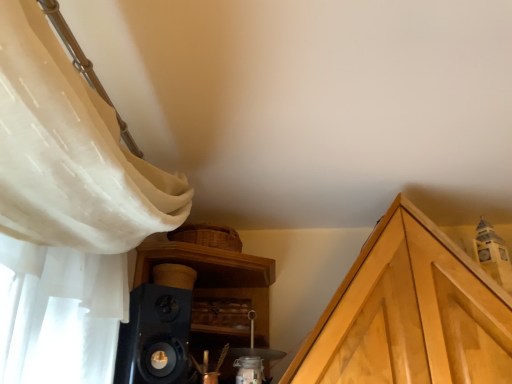
Question: Should I look upward or downward to see light wood cabinetry at upper right?

Choices:
 (A) up
 (B) down

Answer: (B)

Question: Is black matte speaker at lower left positioned with its back to light wood cabinetry at upper right?

Choices:
 (A) no
 (B) yes

Answer: (A)

Question: Can you confirm if black matte speaker at lower left is taller than light wood cabinetry at upper right?

Choices:
 (A) yes
 (B) no

Answer: (B)

Question: Is black matte speaker at lower left outside of light wood cabinetry at upper right?

Choices:
 (A) no
 (B) yes

Answer: (B)

Question: Is the position of black matte speaker at lower left less distant than that of light wood cabinetry at upper right?

Choices:
 (A) no
 (B) yes

Answer: (B)

Question: Considering the relative sizes of black matte speaker at lower left and light wood cabinetry at upper right in the image provided, is black matte speaker at lower left bigger than light wood cabinetry at upper right?

Choices:
 (A) yes
 (B) no

Answer: (B)

Question: From the image's perspective, is black matte speaker at lower left over light wood cabinetry at upper right?

Choices:
 (A) no
 (B) yes

Answer: (B)

Question: Considering the relative positions of light wood cabinetry at upper right and black matte speaker at lower left in the image provided, is light wood cabinetry at upper right to the right of black matte speaker at lower left from the viewer's perspective?

Choices:
 (A) yes
 (B) no

Answer: (A)

Question: Can you confirm if light wood cabinetry at upper right is bigger than black matte speaker at lower left?

Choices:
 (A) no
 (B) yes

Answer: (B)

Question: Does light wood cabinetry at upper right appear on the left side of black matte speaker at lower left?

Choices:
 (A) yes
 (B) no

Answer: (B)

Question: Does light wood cabinetry at upper right have a greater height compared to black matte speaker at lower left?

Choices:
 (A) no
 (B) yes

Answer: (B)

Question: From a real-world perspective, is light wood cabinetry at upper right located beneath black matte speaker at lower left?

Choices:
 (A) no
 (B) yes

Answer: (A)

Question: Can black matte speaker at lower left be found inside light wood cabinetry at upper right?

Choices:
 (A) yes
 (B) no

Answer: (B)

Question: In terms of size, does black matte speaker at lower left appear bigger or smaller than light wood cabinetry at upper right?

Choices:
 (A) small
 (B) big

Answer: (A)